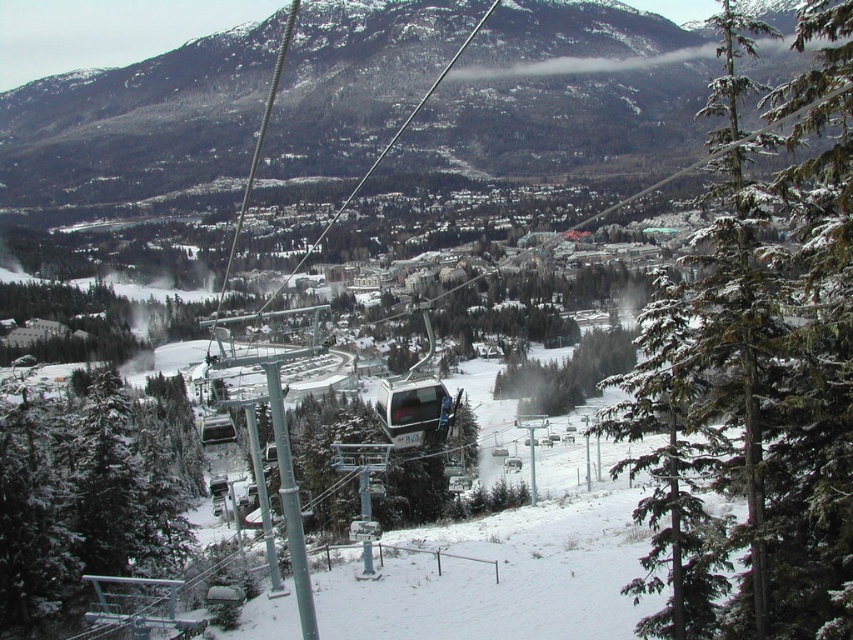
Based on the photo, can you confirm if green textured pine tree at center right is positioned below green matte tree at lower left?

Actually, green textured pine tree at center right is above green matte tree at lower left.

Does green textured pine tree at center right have a lesser height compared to green matte tree at lower left?

Incorrect, green textured pine tree at center right's height does not fall short of green matte tree at lower left's.

Which is behind, point (843, 556) or point (79, 529)?

Positioned behind is point (79, 529).

What are the coordinates of `green textured pine tree at center right` in the screenshot? It's located at (756, 378).

Is green textured pine tree at center right taller than green textured tree at center?

Yes, green textured pine tree at center right is taller than green textured tree at center.

Is point (705, 451) farther from camera compared to point (511, 364)?

No.

Identify the location of green textured pine tree at center right. (756, 378).

The image size is (853, 640). I want to click on green textured pine tree at center right, so click(756, 378).

Does green textured tree at center appear under metallic silver cable car at center?

Correct, green textured tree at center is located below metallic silver cable car at center.

Find the location of `green textured tree at center`. green textured tree at center is located at coordinates (566, 372).

Locate an element on the screen. Image resolution: width=853 pixels, height=640 pixels. green textured tree at center is located at coordinates (566, 372).